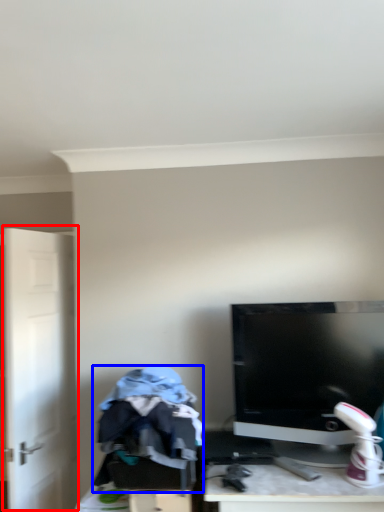
Question: Which object appears farthest to the camera in this image, door (highlighted by a red box) or clothing (highlighted by a blue box)?

Choices:
 (A) door
 (B) clothing

Answer: (A)